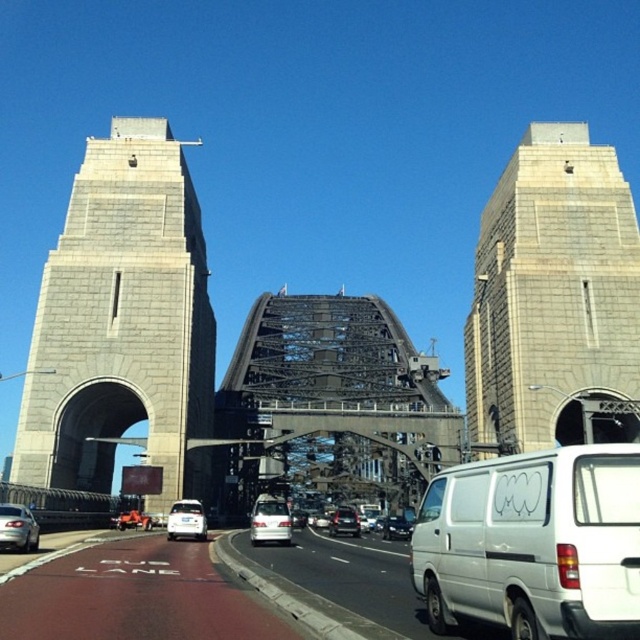
Question: Observing the image, what is the correct spatial positioning of gray stone tower at center in reference to satin silver van at center?

Choices:
 (A) below
 (B) above

Answer: (B)

Question: Is the position of gray stone tower at center less distant than that of shiny silver sedan at center?

Choices:
 (A) yes
 (B) no

Answer: (A)

Question: Which point is farther to the camera?

Choices:
 (A) (272, 531)
 (B) (573, 516)
 (C) (3, 518)
 (D) (166, 529)

Answer: (D)

Question: Which point is farther to the camera?

Choices:
 (A) (97, 262)
 (B) (616, 288)
 (C) (280, 540)
 (D) (632, 545)

Answer: (B)

Question: Can you confirm if white matte van at center is bigger than shiny black suv at center?

Choices:
 (A) yes
 (B) no

Answer: (B)

Question: Estimate the real-world distances between objects in this image. Which object is farther from the shiny black suv at center?

Choices:
 (A) gray stone tower at center
 (B) silver metallic sedan at lower left
 (C) shiny silver sedan at center

Answer: (B)